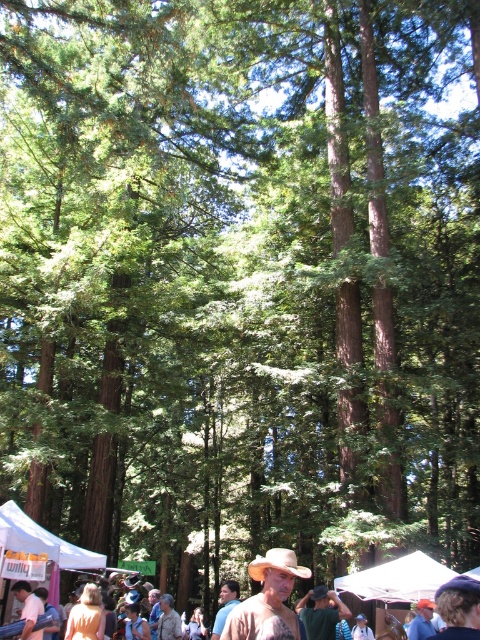
Question: Which is farther from the brown leather hat at lower center?

Choices:
 (A) brown matte hat at center
 (B) brown leather hat at center

Answer: (B)

Question: Is the position of white fabric canopy at lower left less distant than that of brown leather hat at center?

Choices:
 (A) yes
 (B) no

Answer: (A)

Question: Observing the image, what is the correct spatial positioning of white fabric canopy at center in reference to brown felt cowboy hat at center?

Choices:
 (A) right
 (B) left

Answer: (A)

Question: Which point is farther from the camera taking this photo?

Choices:
 (A) (372, 592)
 (B) (280, 570)
 (C) (201, 620)
 (D) (267, 557)

Answer: (C)

Question: Which point is farther from the camera taking this photo?

Choices:
 (A) pyautogui.click(x=418, y=554)
 (B) pyautogui.click(x=28, y=627)
 (C) pyautogui.click(x=284, y=576)
 (D) pyautogui.click(x=8, y=548)

Answer: (A)

Question: Can you confirm if brown leather hat at lower center is positioned to the right of white fabric canopy at center?

Choices:
 (A) no
 (B) yes

Answer: (A)